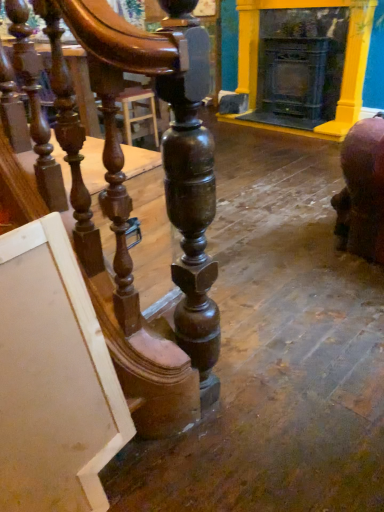
Question: Is matte black fireplace at upper right located within polished wood table at left?

Choices:
 (A) yes
 (B) no

Answer: (B)

Question: Can you confirm if polished wood table at left is wider than matte black fireplace at upper right?

Choices:
 (A) no
 (B) yes

Answer: (B)

Question: From the image's perspective, is polished wood table at left on top of matte black fireplace at upper right?

Choices:
 (A) yes
 (B) no

Answer: (B)

Question: Can you confirm if polished wood table at left is thinner than matte black fireplace at upper right?

Choices:
 (A) no
 (B) yes

Answer: (A)

Question: Is polished wood table at left to the right of matte black fireplace at upper right from the viewer's perspective?

Choices:
 (A) no
 (B) yes

Answer: (A)

Question: Considering the relative sizes of polished wood table at left and matte black fireplace at upper right in the image provided, is polished wood table at left bigger than matte black fireplace at upper right?

Choices:
 (A) no
 (B) yes

Answer: (B)

Question: Is matte black fireplace at upper right further to the viewer compared to polished wood table at left?

Choices:
 (A) no
 (B) yes

Answer: (B)

Question: From a real-world perspective, is matte black fireplace at upper right positioned under polished wood table at left based on gravity?

Choices:
 (A) no
 (B) yes

Answer: (A)

Question: Is matte black fireplace at upper right to the left of polished wood table at left from the viewer's perspective?

Choices:
 (A) yes
 (B) no

Answer: (B)

Question: Is matte black fireplace at upper right taller than polished wood table at left?

Choices:
 (A) yes
 (B) no

Answer: (A)

Question: Is the depth of matte black fireplace at upper right less than that of polished wood table at left?

Choices:
 (A) yes
 (B) no

Answer: (B)

Question: Does matte black fireplace at upper right contain polished wood table at left?

Choices:
 (A) yes
 (B) no

Answer: (B)

Question: From the image's perspective, is polished wood table at left above or below matte black fireplace at upper right?

Choices:
 (A) below
 (B) above

Answer: (A)